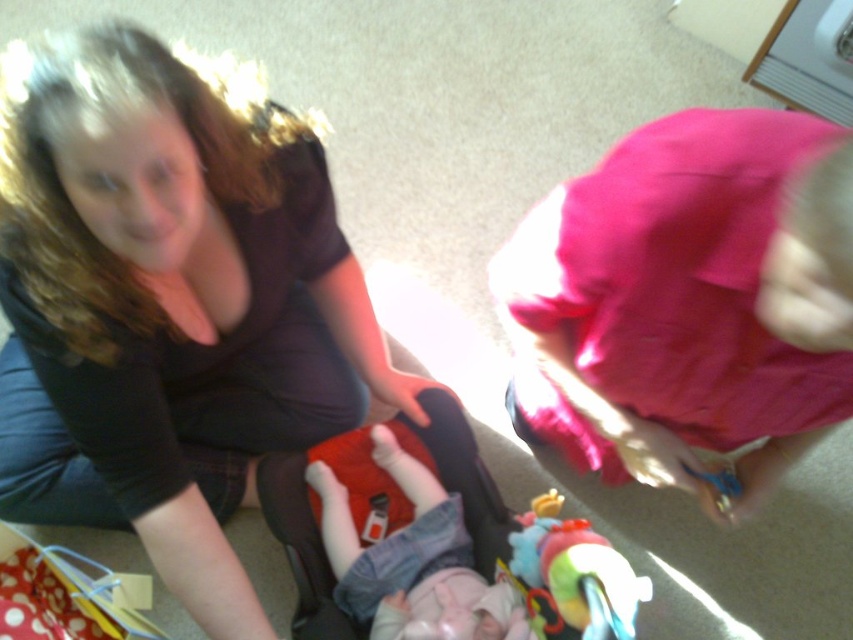
You are standing in the room and see two points marked in the image. Which point is closer to you, point (625, 342) or point (410, 577)?

Point (625, 342) is in front of point (410, 577), so it is closer to you.

You are organizing a clothing donation drive and need to determine which items are larger. You have a matte black shirt at center and a pink fabric at upper right. Which one should you select if you need to choose the larger item for a bigger donation box?

The matte black shirt at center is bigger than the pink fabric at upper right, so you should select the matte black shirt at center for the bigger donation box.

You are trying to decide which item to grab first from the scene. Since the matte black shirt at center is wider than the pink fabric at upper right, which one would you choose if you want to pick the larger object?

The matte black shirt at center is wider than the pink fabric at upper right, so you should choose the matte black shirt at center as it is the larger object.